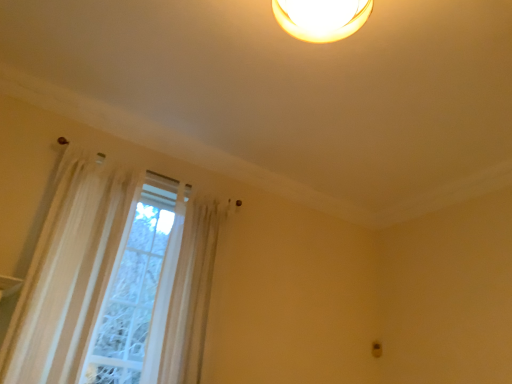
Question: Is sheer white curtain at left to the left or to the right of translucent white curtain at left in the image?

Choices:
 (A) right
 (B) left

Answer: (B)

Question: Looking at their shapes, would you say sheer white curtain at left is wider or thinner than translucent white curtain at left?

Choices:
 (A) wide
 (B) thin

Answer: (B)

Question: Does point (51, 294) appear closer or farther from the camera than point (182, 336)?

Choices:
 (A) closer
 (B) farther

Answer: (A)

Question: Is translucent white curtain at left taller or shorter than sheer white curtain at left?

Choices:
 (A) tall
 (B) short

Answer: (B)

Question: Choose the correct answer: Is translucent white curtain at left inside sheer white curtain at left or outside it?

Choices:
 (A) outside
 (B) inside

Answer: (A)

Question: Based on their sizes in the image, would you say translucent white curtain at left is bigger or smaller than sheer white curtain at left?

Choices:
 (A) big
 (B) small

Answer: (A)

Question: Is translucent white curtain at left in front of or behind sheer white curtain at left in the image?

Choices:
 (A) front
 (B) behind

Answer: (B)